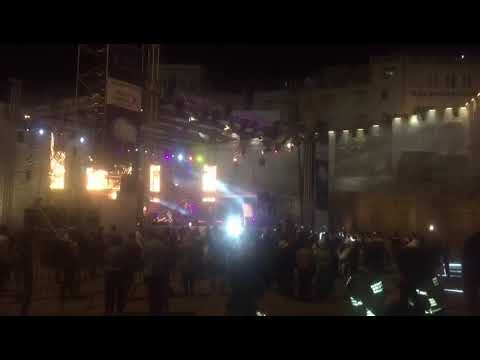
At what (x,y) coordinates should I click in order to perform the action: click on stage. Please return your answer as a coordinate pair (x, y). This screenshot has height=360, width=480. Looking at the image, I should click on (185, 216).